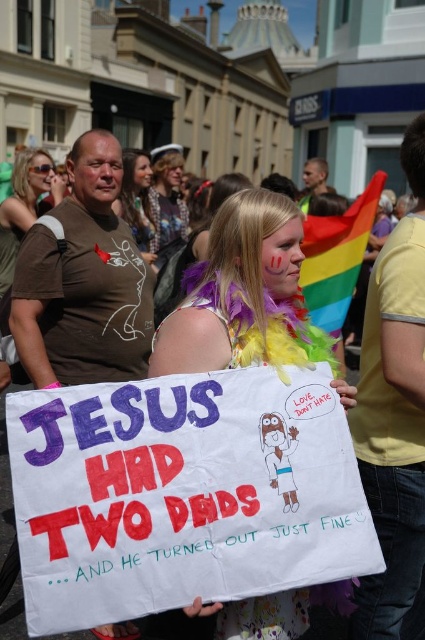
Question: Is rainbow feather boa at center positioned in front of blonde hair at center?

Choices:
 (A) no
 (B) yes

Answer: (B)

Question: Among these points, which one is nearest to the camera?

Choices:
 (A) (243, 340)
 (B) (141, 212)

Answer: (A)

Question: Can you confirm if rainbow feather boa at center is positioned to the left of blonde hair at center?

Choices:
 (A) no
 (B) yes

Answer: (A)

Question: Where is rainbow feather boa at center located in relation to blonde hair at center in the image?

Choices:
 (A) below
 (B) above

Answer: (A)

Question: Which object is farther from the camera taking this photo?

Choices:
 (A) rainbow feather boa at center
 (B) blonde hair at center

Answer: (B)